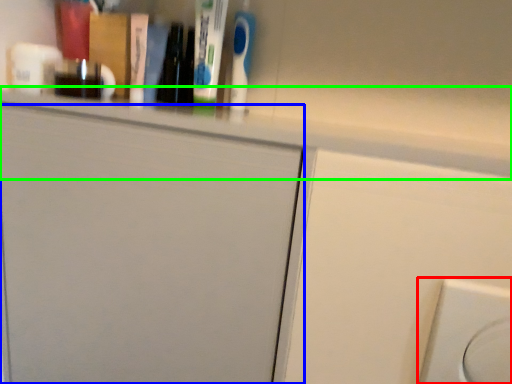
Question: Estimate the real-world distances between objects in this image. Which object is farther from electric outlet (highlighted by a red box), door (highlighted by a blue box) or ledge (highlighted by a green box)?

Choices:
 (A) door
 (B) ledge

Answer: (A)